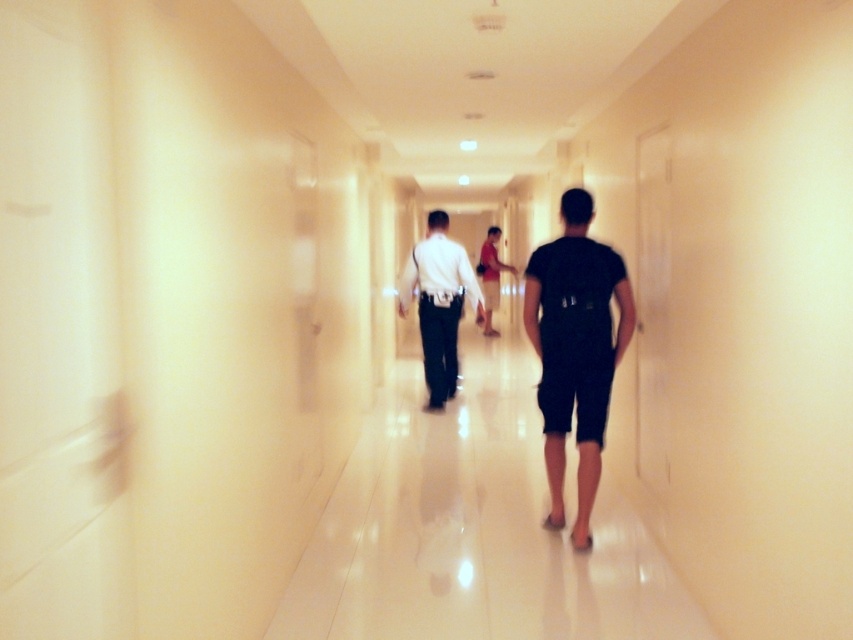
You are a fashion designer observing the two individuals in the corridor. You need to determine which clothing item has a narrower width between the black matte shorts at center and the white glossy shirt at center. Which one is narrower?

The black matte shorts at center has a narrower width than the white glossy shirt at center according to the description.

Looking at this image, you are trying to decide which shirt to wear for a casual event. Both the white glossy shirt at center and the matte red shirt at center are options. Based on their appearance in the image, which shirt takes up more visual space?

The matte red shirt at center occupies more visual space than the white glossy shirt at center, according to the description.

Based on the photo, you are a photographer standing at the end of the corridor. You want to take a photo that captures both the black matte shorts at center and the matte red shirt at center in the same frame. Which object will appear larger in the photo?

The black matte shorts at center will appear larger in the photo because it is much taller than the matte red shirt at center.